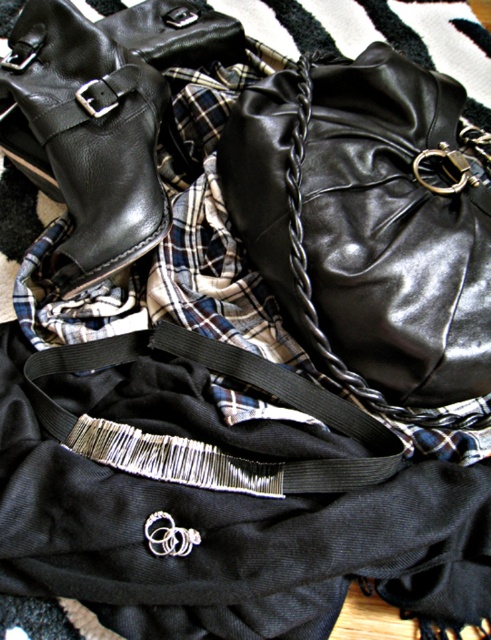
Is glossy leather bag at upper right wider than black fabric strap at center?

Incorrect, glossy leather bag at upper right's width does not surpass black fabric strap at center's.

Between point (339, 252) and point (295, 394), which one is positioned behind?

Positioned behind is point (295, 394).

Image resolution: width=491 pixels, height=640 pixels. Find the location of `glossy leather bag at upper right`. glossy leather bag at upper right is located at coordinates (369, 221).

Image resolution: width=491 pixels, height=640 pixels. In order to click on glossy leather bag at upper right in this screenshot , I will do `click(369, 221)`.

Between shiny black leather boot at upper left and black fabric strap at center, which one appears on the left side from the viewer's perspective?

Positioned to the left is shiny black leather boot at upper left.

Between point (136, 131) and point (329, 460), which one is positioned behind?

Point (136, 131)

I want to click on shiny black leather boot at upper left, so click(x=85, y=136).

From the picture: Is glossy leather bag at upper right further to camera compared to shiny black leather boot at upper left?

No, it is not.

Looking at this image, between glossy leather bag at upper right and shiny black leather boot at upper left, which one has less height?

With less height is shiny black leather boot at upper left.

Find the location of a particular element. The height and width of the screenshot is (640, 491). glossy leather bag at upper right is located at coordinates (369, 221).

Image resolution: width=491 pixels, height=640 pixels. I want to click on glossy leather bag at upper right, so click(x=369, y=221).